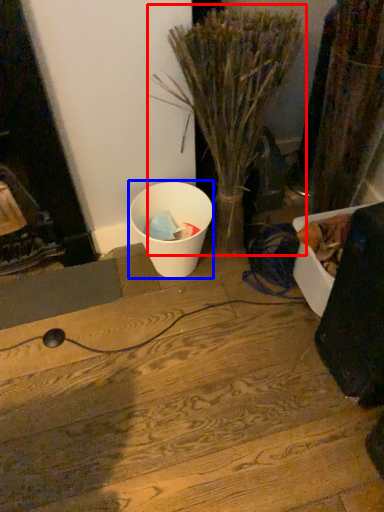
Question: Which object is further to the camera taking this photo, houseplant (highlighted by a red box) or waste (highlighted by a blue box)?

Choices:
 (A) houseplant
 (B) waste

Answer: (B)